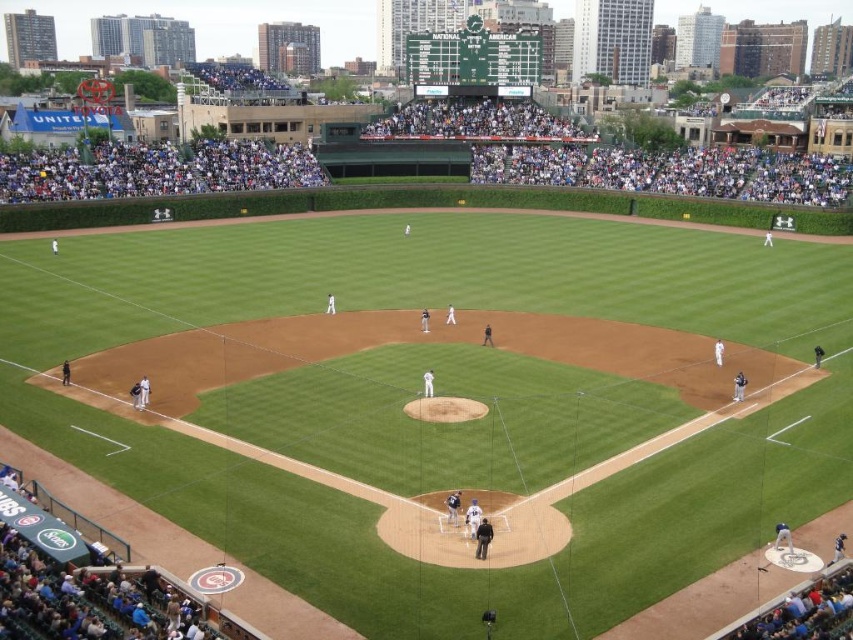
You are a photographer at Wrigley Field trying to capture the excitement of the game. You notice the white fabric crowd at upper left and the dark gray uniform at lower right. Which of these two elements would appear closer to the camera if they were the same size in reality?

The dark gray uniform at lower right would appear closer to the camera because it is smaller in the image compared to the white fabric crowd at upper left, which is larger and thus farther away.

You are standing at the center field position in Wrigley Field. A ball is hit towards the point marked at coordinates [111,156]. If you can run 10 meters per second, how many seconds will it take you to reach that point?

The point at coordinates [111,156] is 102.00 meters away from the viewer. At a running speed of 10 meters per second, it would take 10.2 seconds to reach that point.